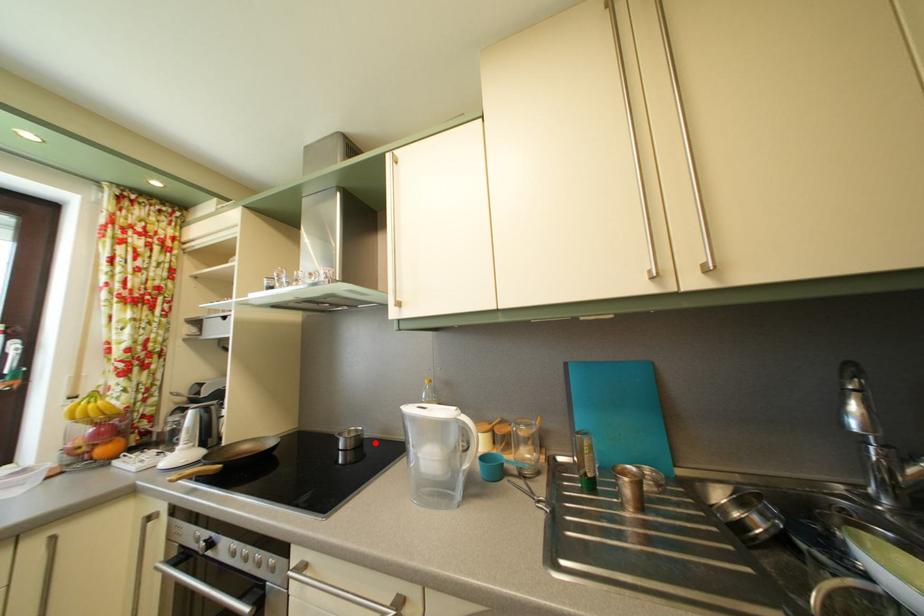
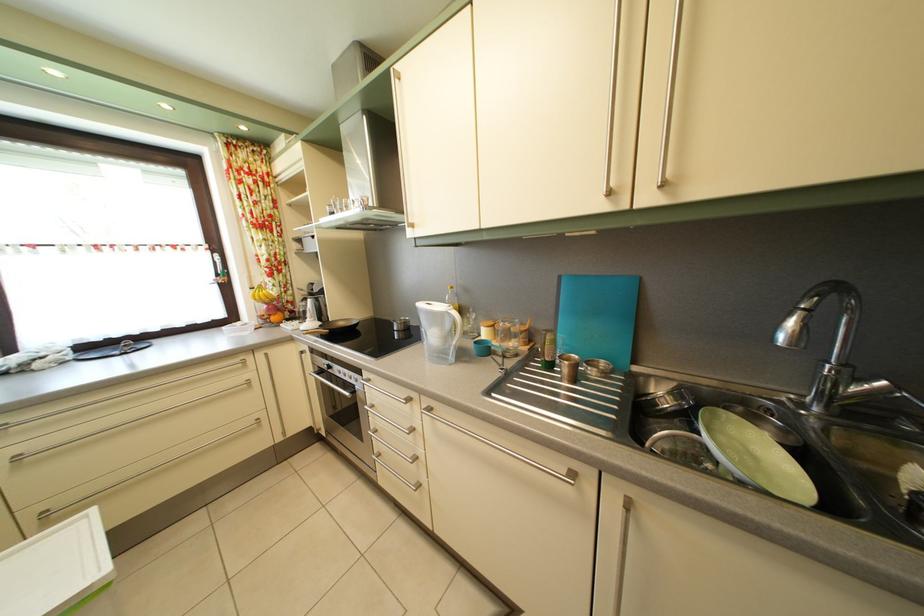
The point at the highlighted location is marked in the first image. Where is the corresponding point in the second image?

(420, 331)